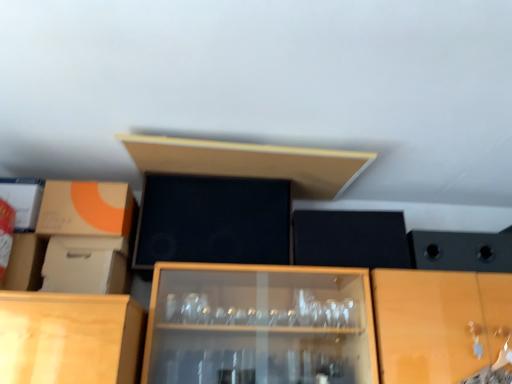
At what (x,y) coordinates should I click in order to perform the action: click on free spot above black matte speaker at center (from a real-world perspective). Please return your answer as a coordinate pair (x, y). The image size is (512, 384). Looking at the image, I should click on (224, 173).